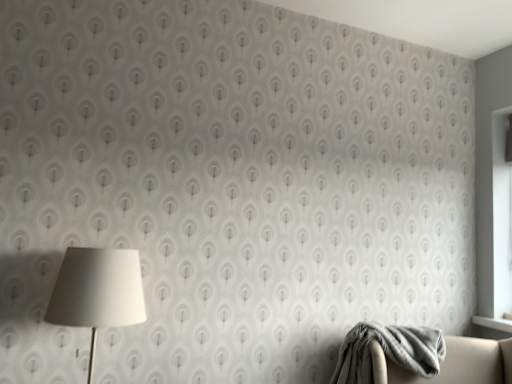
The height and width of the screenshot is (384, 512). Find the location of `gray soft blanket at lower right`. gray soft blanket at lower right is located at coordinates (389, 351).

Measure the distance between point (x=412, y=361) and camera.

1.83 meters.

Describe the element at coordinates (389, 351) in the screenshot. I see `gray soft blanket at lower right` at that location.

This screenshot has width=512, height=384. What do you see at coordinates (97, 292) in the screenshot?
I see `white matte lamp at left` at bounding box center [97, 292].

From the picture: What is the approximate width of white matte lamp at left?

It is 12.10 inches.

You are a GUI agent. You are given a task and a screenshot of the screen. Output one action in this format:
    pyautogui.click(x=<x>, y=<y>)
    Task: Click on the white matte lamp at left
    The image size is (512, 384).
    Given the screenshot: What is the action you would take?
    pyautogui.click(x=97, y=292)

I want to click on gray soft blanket at lower right, so click(x=389, y=351).

Which is more to the right, white matte lamp at left or gray soft blanket at lower right?

gray soft blanket at lower right is more to the right.

Which object is closer to the camera, white matte lamp at left or gray soft blanket at lower right?

white matte lamp at left.

Does point (141, 310) come closer to viewer compared to point (409, 330)?

Yes, it is.

From the image's perspective, which object appears higher, white matte lamp at left or gray soft blanket at lower right?

white matte lamp at left is shown above in the image.

From a real-world perspective, which object stands above the other?

white matte lamp at left.

Considering the sizes of objects white matte lamp at left and gray soft blanket at lower right in the image provided, who is wider, white matte lamp at left or gray soft blanket at lower right?

gray soft blanket at lower right.

Considering the relative sizes of white matte lamp at left and gray soft blanket at lower right in the image provided, is white matte lamp at left shorter than gray soft blanket at lower right?

No.

Considering the sizes of white matte lamp at left and gray soft blanket at lower right in the image, is white matte lamp at left bigger or smaller than gray soft blanket at lower right?

In the image, white matte lamp at left appears to be smaller than gray soft blanket at lower right.

Is white matte lamp at left completely or partially outside of gray soft blanket at lower right?

white matte lamp at left lies outside gray soft blanket at lower right's area.

Is white matte lamp at left not close to gray soft blanket at lower right?

Yes.

Could you tell me if white matte lamp at left is facing gray soft blanket at lower right?

No, white matte lamp at left is not aimed at gray soft blanket at lower right.

You are a GUI agent. You are given a task and a screenshot of the screen. Output one action in this format:
    pyautogui.click(x=<x>, y=<y>)
    Task: Click on the blanket behind the white matte lamp at left
    
    Given the screenshot: What is the action you would take?
    pyautogui.click(x=389, y=351)

Considering the relative positions of gray soft blanket at lower right and white matte lamp at left in the image provided, is gray soft blanket at lower right to the right of white matte lamp at left from the viewer's perspective?

Yes, gray soft blanket at lower right is to the right of white matte lamp at left.

Is gray soft blanket at lower right positioned in front of white matte lamp at left?

No, gray soft blanket at lower right is behind white matte lamp at left.

Does point (434, 353) come behind point (116, 249)?

Yes.

From the image's perspective, relative to white matte lamp at left, is gray soft blanket at lower right above or below?

gray soft blanket at lower right is situated lower than white matte lamp at left in the image.

In the scene shown: From a real-world perspective, is gray soft blanket at lower right physically located above or below white matte lamp at left?

In terms of real-world spatial position, gray soft blanket at lower right is below white matte lamp at left.

Between gray soft blanket at lower right and white matte lamp at left, which one has larger width?

With larger width is gray soft blanket at lower right.

In the scene shown: Does gray soft blanket at lower right have a lesser height compared to white matte lamp at left?

Yes, gray soft blanket at lower right is shorter than white matte lamp at left.

Does gray soft blanket at lower right have a larger size compared to white matte lamp at left?

Yes, gray soft blanket at lower right is bigger than white matte lamp at left.

Would you say gray soft blanket at lower right is outside white matte lamp at left?

Yes, gray soft blanket at lower right is located beyond the bounds of white matte lamp at left.

In the scene shown: Is gray soft blanket at lower right directly adjacent to white matte lamp at left?

No, gray soft blanket at lower right is not next to white matte lamp at left.

Could you tell me if gray soft blanket at lower right is turned towards white matte lamp at left?

No, gray soft blanket at lower right is not turned towards white matte lamp at left.

Locate an element on the screen. lamp above the gray soft blanket at lower right (from a real-world perspective) is located at coordinates (97, 292).

Image resolution: width=512 pixels, height=384 pixels. What are the coordinates of `blanket below the white matte lamp at left (from the image's perspective)` in the screenshot? It's located at (389, 351).

The height and width of the screenshot is (384, 512). I want to click on blanket on the right of white matte lamp at left, so click(x=389, y=351).